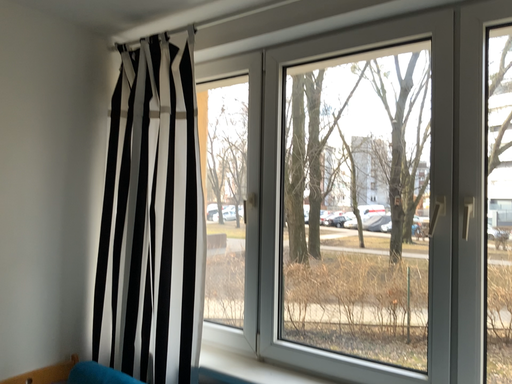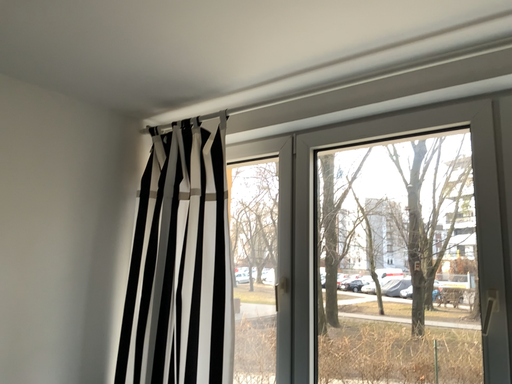
Question: Which way did the camera rotate in the video?

Choices:
 (A) rotated upward
 (B) rotated downward

Answer: (A)